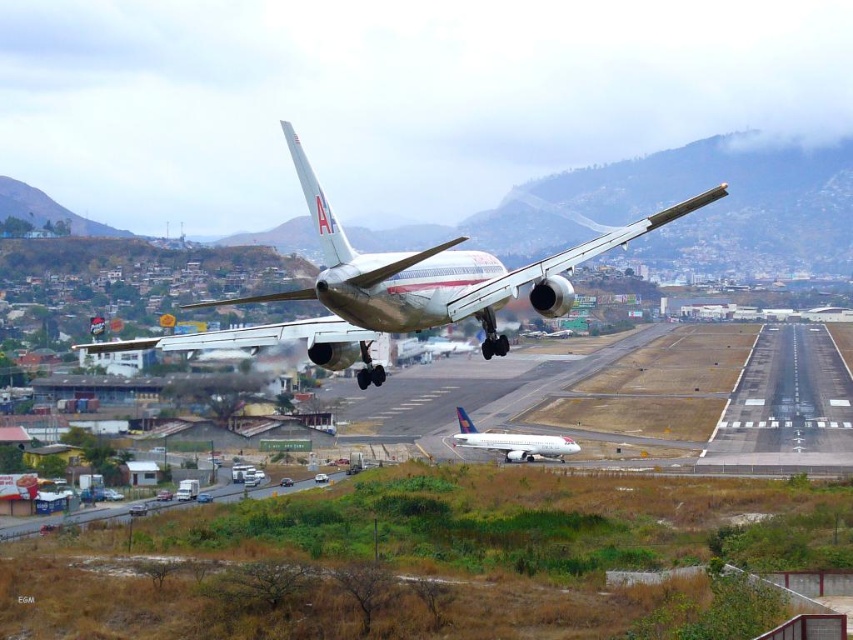
You are an air traffic controller observing two airplanes in the sky. You see the metallic silver airplane at center and the white glossy airplane at center. Which airplane is located to the left of the other?

The metallic silver airplane at center is positioned on the left side of white glossy airplane at center.

You are standing at the airport and want to reach the point marked as point [529,273]. If your walking speed is 1.5 meters per second, how many seconds will it take to reach the point?

The distance of point [529,273] from viewer is 22.64 meters. At a walking speed of 1.5 meters per second, it will take approximately 15.09 seconds to reach the point.

Consider the image. You are a pilot observing the airport scene. There is a point at coordinates point (399, 289). Which object in the scene is this point located on?

The point (399, 289) is located on the metallic silver airplane at center.